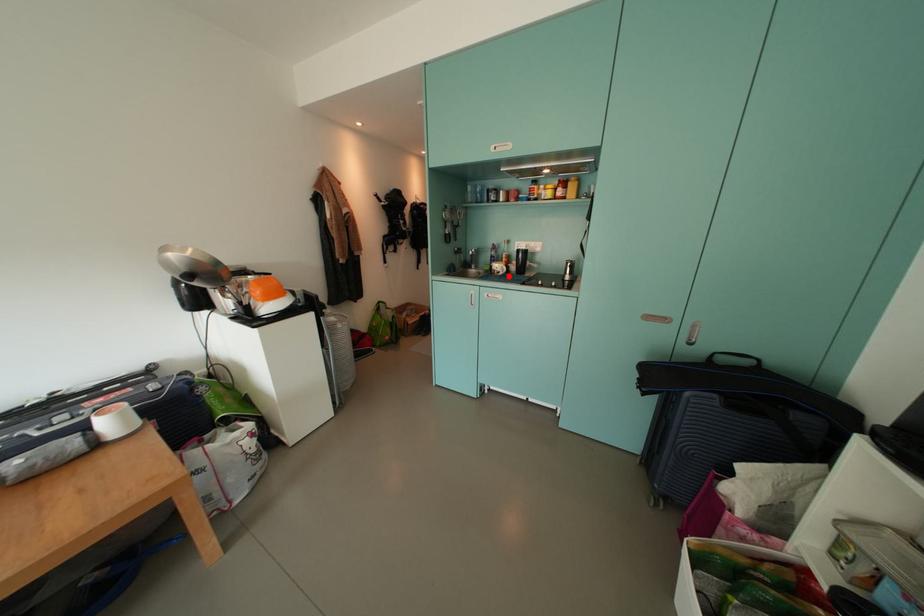
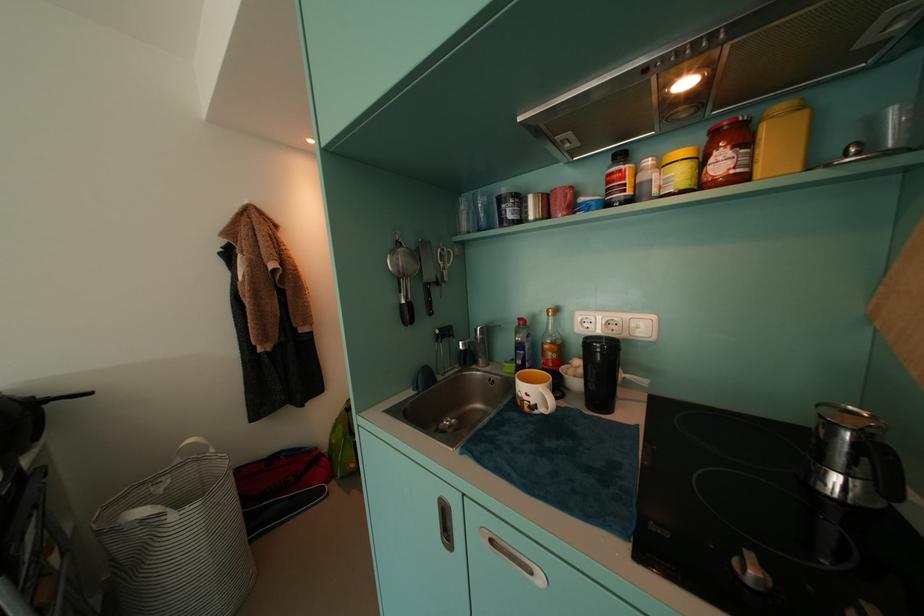
Locate, in the second image, the point that corresponds to the highlighted location in the first image.

(550, 413)